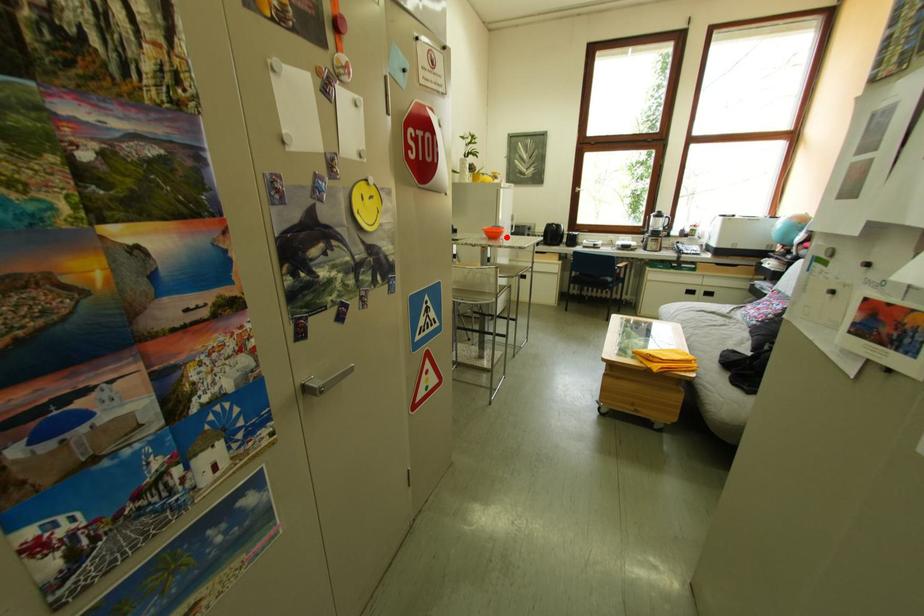
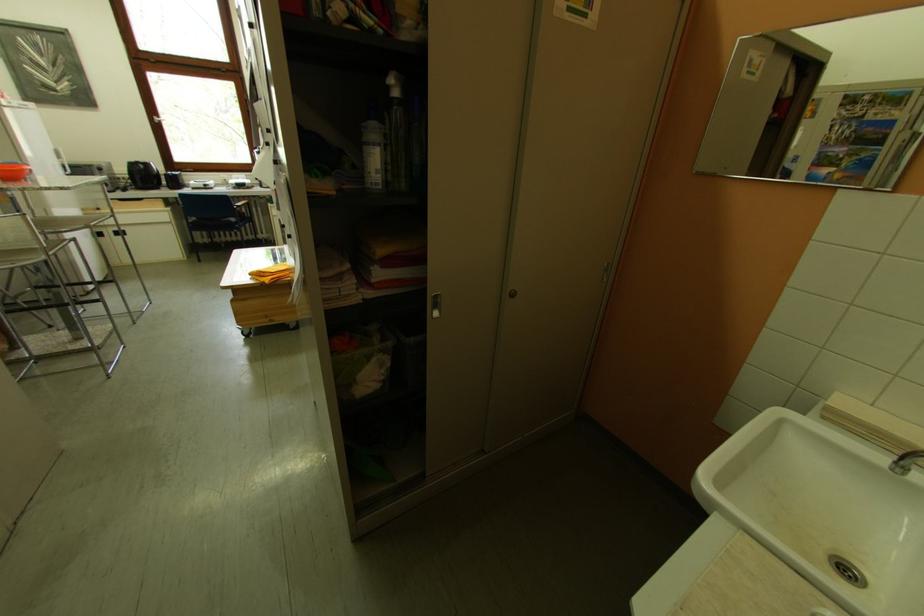
Question: A red point is marked in image1. In image2, is the corresponding 3D point closer to the camera or farther? Reply with the corresponding letter.

Choices:
 (A) The corresponding 3D point is closer.
 (B) The corresponding 3D point is farther.

Answer: (B)